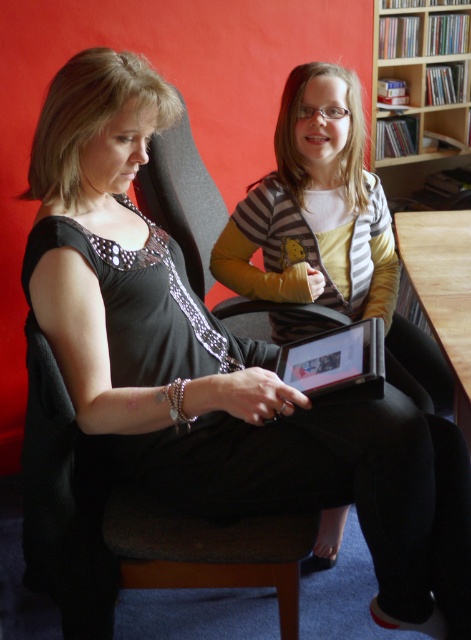
Does wooden bookshelf at upper right have a lesser height compared to black plastic tablet at center?

No.

Is point (395, 141) positioned before point (360, 324)?

No, it is not.

In order to click on wooden bookshelf at upper right in this screenshot , I will do `click(422, 92)`.

Based on the photo, is striped sweater at center below wooden bookshelf at upper right?

Indeed, striped sweater at center is positioned under wooden bookshelf at upper right.

Is striped sweater at center wider than wooden bookshelf at upper right?

Correct, the width of striped sweater at center exceeds that of wooden bookshelf at upper right.

Between point (308, 253) and point (423, 68), which one is positioned in front?

Point (308, 253) is more forward.

Locate an element on the screen. This screenshot has height=640, width=471. striped sweater at center is located at coordinates (325, 224).

Does striped sweater at center lie in front of black plastic tablet at center?

No, striped sweater at center is further to the viewer.

Is striped sweater at center wider than black plastic tablet at center?

Correct, the width of striped sweater at center exceeds that of black plastic tablet at center.

Is point (392, 336) closer to camera compared to point (346, 388)?

No, (392, 336) is further to viewer.

Where is `striped sweater at center`? This screenshot has height=640, width=471. striped sweater at center is located at coordinates (325, 224).